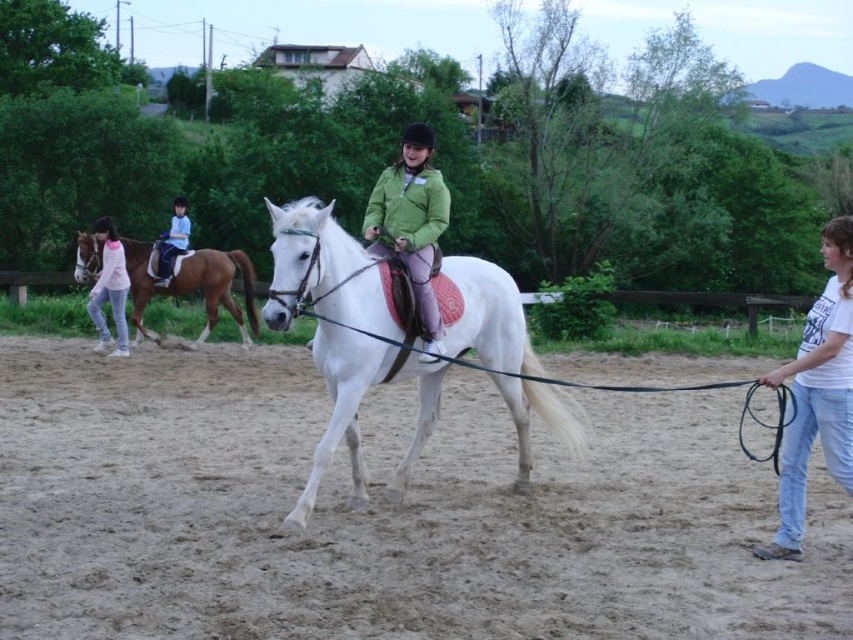
Is point (422, 310) less distant than point (178, 220)?

Yes, point (422, 310) is in front of point (178, 220).

Who is more forward, (410, 243) or (158, 275)?

Point (410, 243) is more forward.

Identify the location of green matte jacket at center. (410, 225).

Identify the location of green matte jacket at center. (410, 225).

Between white cotton shirt at right and light blue denim pants at left, which one has more height?

white cotton shirt at right

Does white cotton shirt at right have a larger size compared to light blue denim pants at left?

Correct, white cotton shirt at right is larger in size than light blue denim pants at left.

Image resolution: width=853 pixels, height=640 pixels. What are the coordinates of `white cotton shirt at right` in the screenshot? It's located at pyautogui.click(x=817, y=394).

Can you confirm if sandy dirt field at center is taller than white glossy horse at center?

Incorrect, sandy dirt field at center's height is not larger of white glossy horse at center's.

Is point (171, 413) positioned before point (386, 371)?

No, (171, 413) is behind (386, 371).

Is point (114, 582) closer to viewer compared to point (299, 244)?

Yes, point (114, 582) is closer to viewer.

I want to click on sandy dirt field at center, so click(x=381, y=513).